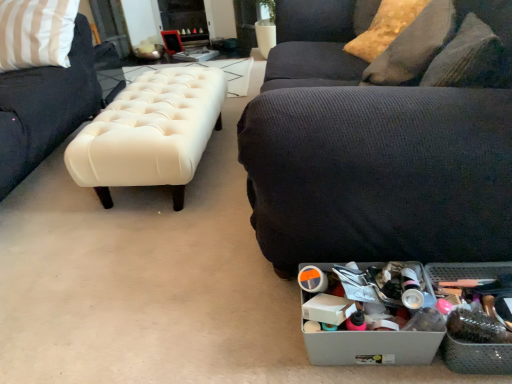
Question: Considering the relative positions of metallic gray storage box at lower right, the 1th storage box when ordered from right to left, and metallic gray storage box at lower right, which is counted as the first storage box, starting from the left, in the image provided, is metallic gray storage box at lower right, the 1th storage box when ordered from right to left, to the left of metallic gray storage box at lower right, which is counted as the first storage box, starting from the left, from the viewer's perspective?

Choices:
 (A) yes
 (B) no

Answer: (B)

Question: From a real-world perspective, is metallic gray storage box at lower right, the 1th storage box when ordered from right to left, located higher than metallic gray storage box at lower right, which is the second storage box in right-to-left order?

Choices:
 (A) no
 (B) yes

Answer: (A)

Question: Is metallic gray storage box at lower right, which is the 2th storage box from left to right, completely or partially outside of metallic gray storage box at lower right, which is the second storage box in right-to-left order?

Choices:
 (A) no
 (B) yes

Answer: (B)

Question: Does metallic gray storage box at lower right, which is the 2th storage box from left to right, lie in front of metallic gray storage box at lower right, which is counted as the first storage box, starting from the left?

Choices:
 (A) no
 (B) yes

Answer: (B)

Question: Is metallic gray storage box at lower right, which is counted as the first storage box, starting from the left, located within metallic gray storage box at lower right, which is the 2th storage box from left to right?

Choices:
 (A) yes
 (B) no

Answer: (B)

Question: Is metallic gray storage box at lower right, the 1th storage box when ordered from right to left, in contact with metallic gray storage box at lower right, which is counted as the first storage box, starting from the left?

Choices:
 (A) no
 (B) yes

Answer: (A)

Question: Can you confirm if shiny gold pillow at upper right, the second pillow ordered from the bottom, is wider than metallic gray storage box at lower right, which is counted as the first storage box, starting from the left?

Choices:
 (A) no
 (B) yes

Answer: (B)

Question: From the image's perspective, does shiny gold pillow at upper right, the second pillow ordered from the bottom, appear lower than metallic gray storage box at lower right, which is counted as the first storage box, starting from the left?

Choices:
 (A) no
 (B) yes

Answer: (A)

Question: Is shiny gold pillow at upper right, the second pillow ordered from the bottom, positioned far away from metallic gray storage box at lower right, which is counted as the first storage box, starting from the left?

Choices:
 (A) no
 (B) yes

Answer: (B)

Question: From the image's perspective, would you say shiny gold pillow at upper right, the second pillow ordered from the bottom, is positioned over metallic gray storage box at lower right, which is the second storage box in right-to-left order?

Choices:
 (A) no
 (B) yes

Answer: (B)

Question: Does shiny gold pillow at upper right, the second pillow ordered from the bottom, have a greater height compared to metallic gray storage box at lower right, which is the second storage box in right-to-left order?

Choices:
 (A) yes
 (B) no

Answer: (A)

Question: Is shiny gold pillow at upper right, the second pillow ordered from the bottom, to the left of metallic gray storage box at lower right, which is counted as the first storage box, starting from the left, from the viewer's perspective?

Choices:
 (A) no
 (B) yes

Answer: (A)

Question: From a real-world perspective, is metallic gray storage box at lower right, the 1th storage box when ordered from right to left, located higher than creamy leather bench at center?

Choices:
 (A) no
 (B) yes

Answer: (A)